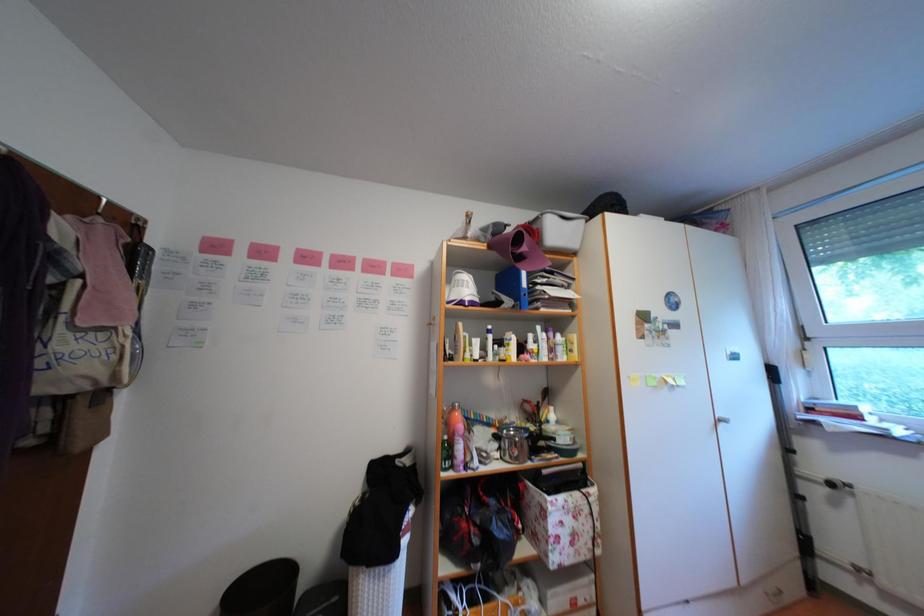
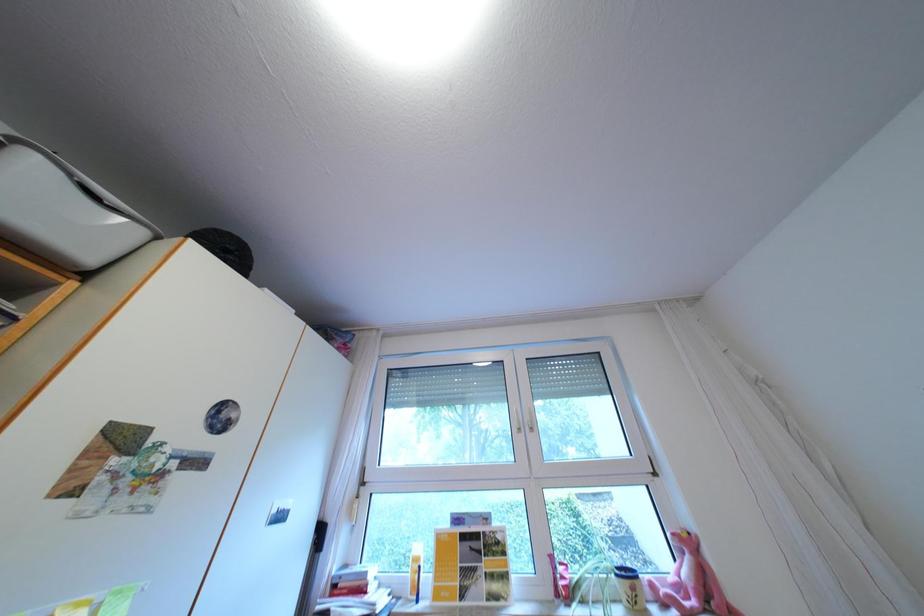
The first image is from the beginning of the video and the second image is from the end. How did the camera likely rotate when shooting the video?

The camera's rotation is toward right-up.